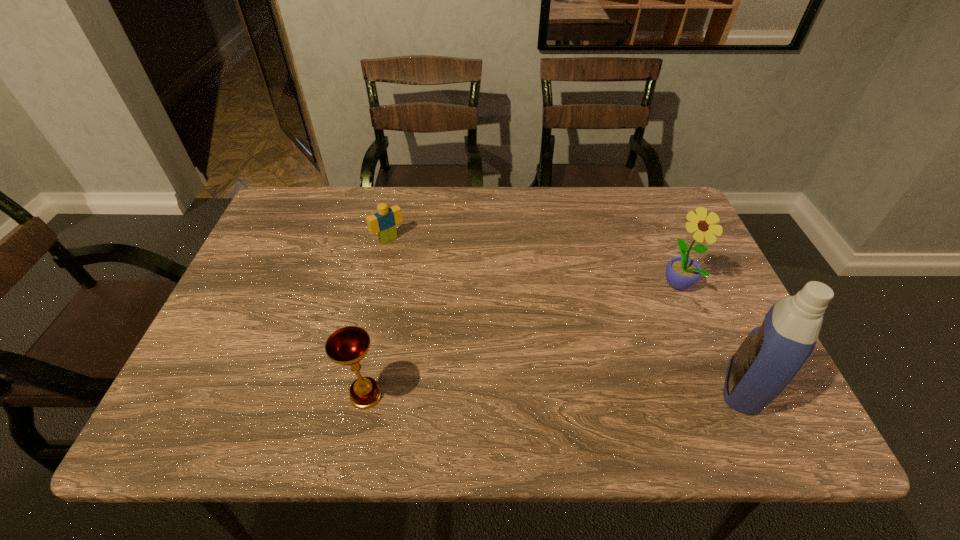
Identify the location of free location that satisfies the following two spatial constraints: 1. on the front side of the farthest object; 2. on the left side of the chalice. (354, 396).

You are a GUI agent. You are given a task and a screenshot of the screen. Output one action in this format:
    pyautogui.click(x=<x>, y=<y>)
    Task: Click on the vacant area in the image that satisfies the following two spatial constraints: 1. on the front side of the farthest object; 2. on the right side of the third nearest object
    The height and width of the screenshot is (540, 960).
    Given the screenshot: What is the action you would take?
    pyautogui.click(x=379, y=283)

Locate an element on the screen. The image size is (960, 540). free space that satisfies the following two spatial constraints: 1. on the front side of the detergent; 2. on the left side of the sunflower is located at coordinates (721, 387).